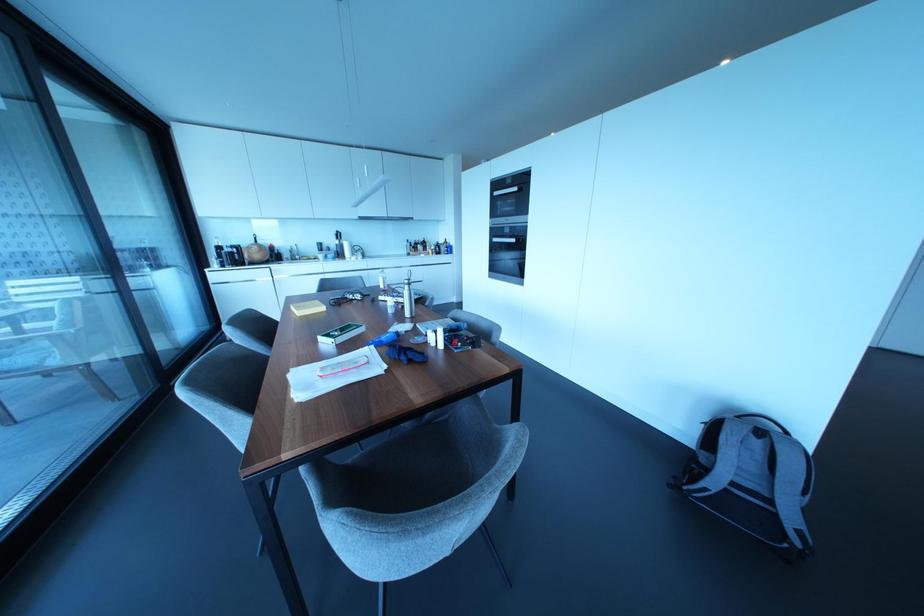
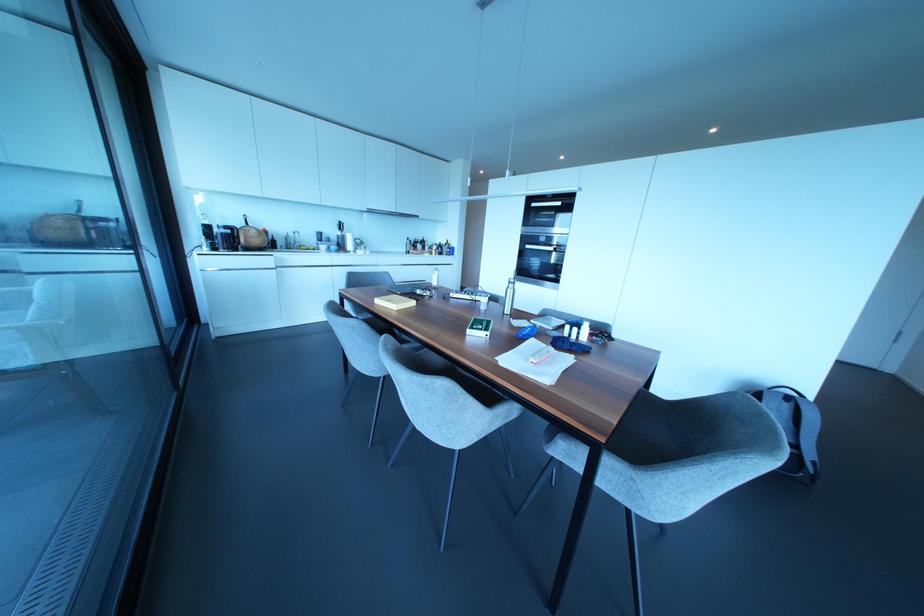
Where in the second image is the point corresponding to [440,345] from the first image?

(584, 338)